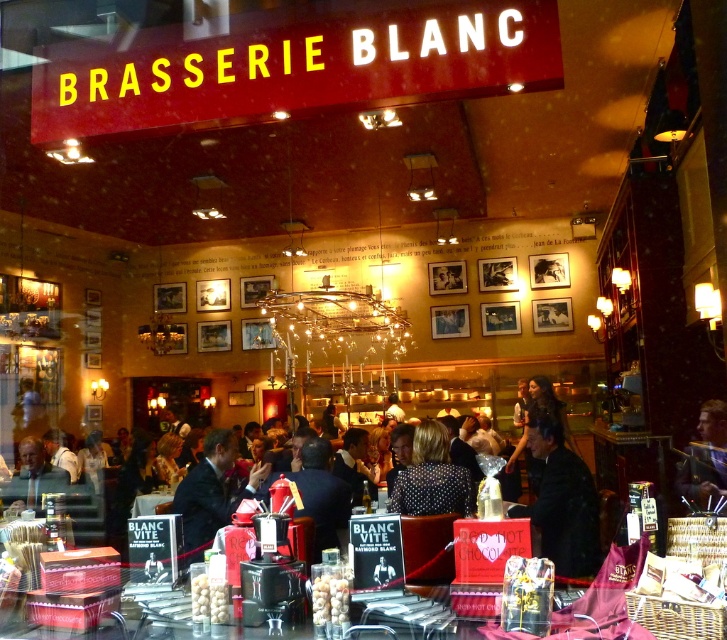
Does translucent glass table at center appear on the left side of black dotted dress at center?

Indeed, translucent glass table at center is positioned on the left side of black dotted dress at center.

Who is taller, translucent glass table at center or black dotted dress at center?

With more height is black dotted dress at center.

Between point (24, 634) and point (393, 486), which one is positioned behind?

The point (393, 486) is more distant.

Find the location of a particular element. The image size is (727, 640). translucent glass table at center is located at coordinates (598, 618).

Can you confirm if translucent glass table at center is positioned below dark suit at center?

Incorrect, translucent glass table at center is not positioned below dark suit at center.

Can you confirm if translucent glass table at center is thinner than dark suit at center?

Incorrect, translucent glass table at center's width is not less than dark suit at center's.

Where is `translucent glass table at center`? The image size is (727, 640). translucent glass table at center is located at coordinates (598, 618).

Where is `translucent glass table at center`? The width and height of the screenshot is (727, 640). translucent glass table at center is located at coordinates (598, 618).

Who is more distant from viewer, (566, 563) or (441, 502)?

Point (441, 502)

Can you confirm if black matte jacket at center is thinner than black dotted dress at center?

No.

Which is behind, point (590, 540) or point (401, 486)?

Positioned behind is point (401, 486).

Identify the location of black matte jacket at center. The image size is (727, 640). (562, 502).